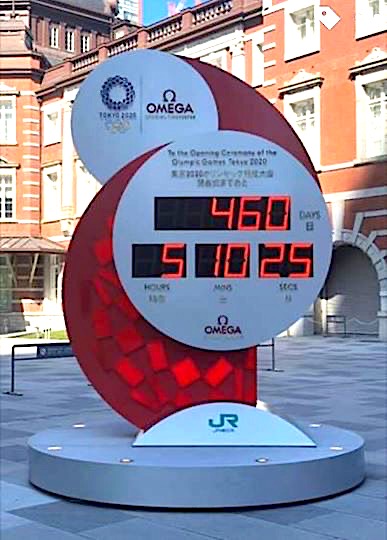
Identify the location of floor. (311, 396).